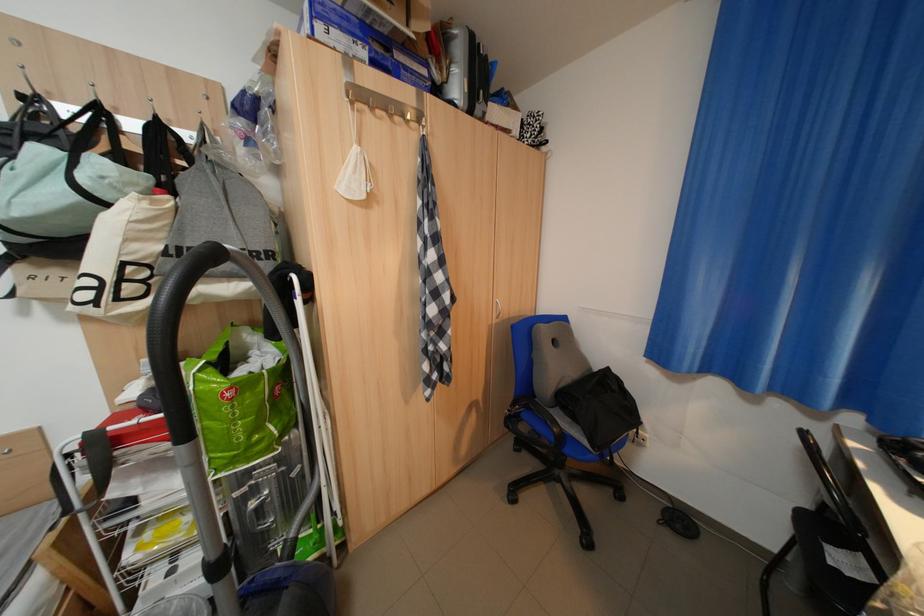
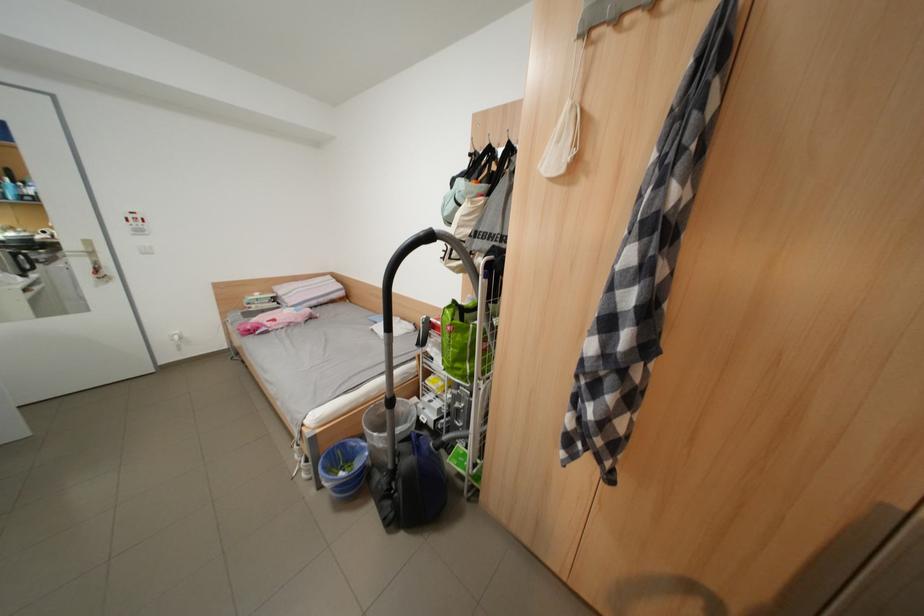
Where in the second image is the point corresponding to (366,174) from the first image?

(569, 142)